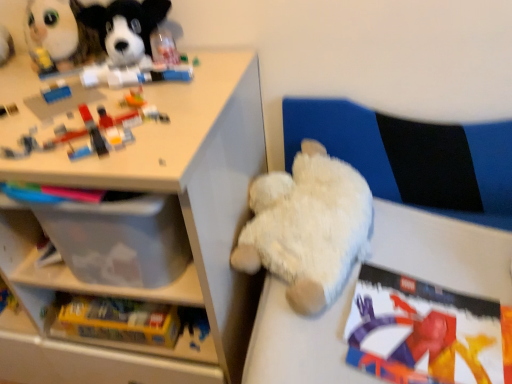
Question: Is matte plastic book at lower right to the left or to the right of white plastic shelf at upper left in the image?

Choices:
 (A) left
 (B) right

Answer: (B)

Question: Is matte plastic book at lower right spatially inside white plastic shelf at upper left, or outside of it?

Choices:
 (A) inside
 (B) outside

Answer: (B)

Question: Which of these objects is positioned farthest from the white fluffy teddy bear at center, marked as the 4th toy in a left-to-right arrangement?

Choices:
 (A) white plastic shelf at upper left
 (B) soft plush dog at upper left, the 3th toy from the left
 (C) matte plastic book at lower right
 (D) brick-like plastic toys at upper left, the third toy viewed from the right
 (E) fluffy white plush at upper left, which is the 4th toy in right-to-left order

Answer: (E)

Question: Which object is positioned farthest from the matte plastic book at lower right?

Choices:
 (A) white fluffy teddy bear at center, marked as the 4th toy in a left-to-right arrangement
 (B) fluffy white plush at upper left, the first toy viewed from the left
 (C) white plastic shelf at upper left
 (D) soft plush dog at upper left, the 2th toy when ordered from right to left
 (E) brick-like plastic toys at upper left, the third toy viewed from the right

Answer: (B)